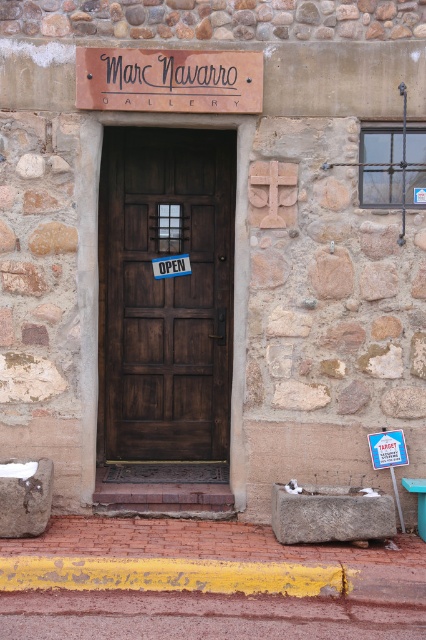
You are a delivery person approaching the entrance of the Marc Navarro Gallery. You need to place a heavy box on the ground near the wooden sign at center and the rusty metal curb at lower center. Which object should you place the box closer to if you want it to be as far as possible from the door?

The wooden sign at center is positioned on the left side of the rusty metal curb at lower center. Since the wooden sign is closer to the door than the curb, placing the box near the rusty metal curb at lower center would keep it farther from the door.